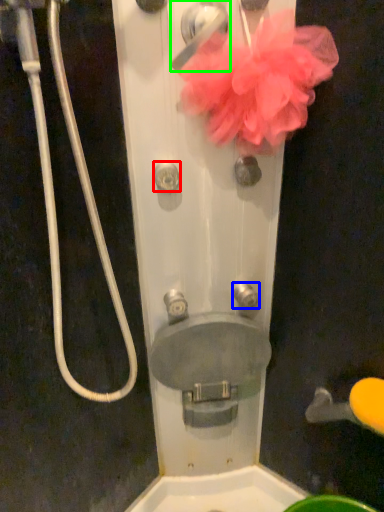
Question: Based on their relative distances, which object is farther from knob (highlighted by a red box)? Choose from knob (highlighted by a blue box) and door handle (highlighted by a green box).

Choices:
 (A) knob
 (B) door handle

Answer: (A)